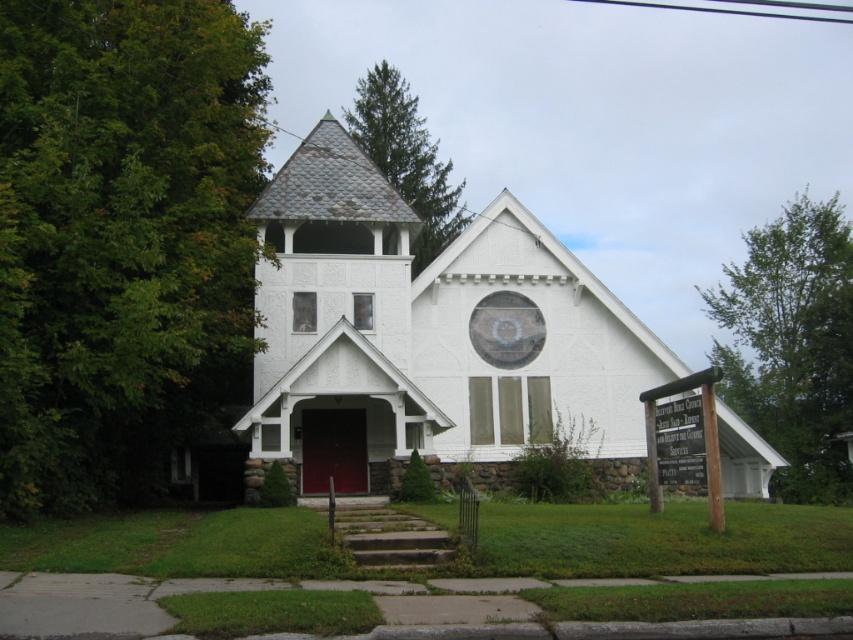
Question: Estimate the real-world distances between objects in this image. Which object is farther from the white textured church at center?

Choices:
 (A) green textured pine tree at upper center
 (B) green leafy tree at left

Answer: (A)

Question: Does green leafy tree at left appear on the right side of green textured pine tree at upper center?

Choices:
 (A) yes
 (B) no

Answer: (B)

Question: Which point is closer to the camera?

Choices:
 (A) (810, 364)
 (B) (424, 227)
 (C) (316, 483)
 (D) (248, 36)

Answer: (D)

Question: Is green leafy tree at upper right above green textured pine tree at upper center?

Choices:
 (A) no
 (B) yes

Answer: (A)

Question: Can you confirm if green leafy tree at left is positioned to the left of green leafy tree at upper right?

Choices:
 (A) no
 (B) yes

Answer: (B)

Question: Among these objects, which one is nearest to the camera?

Choices:
 (A) green textured pine tree at upper center
 (B) green leafy tree at left
 (C) white textured church at center

Answer: (B)